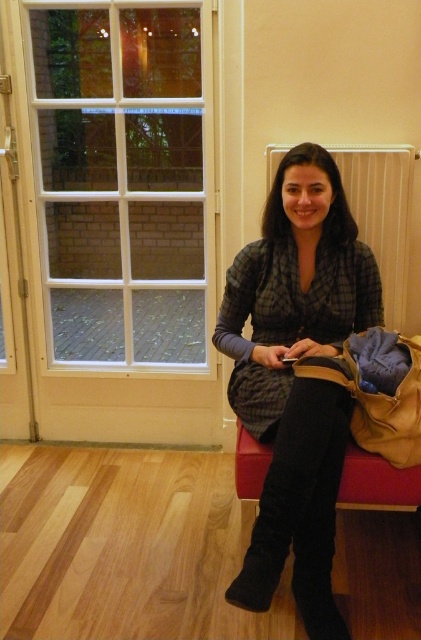
Can you confirm if matte plaid dress at center is positioned above leather-like stool at lower center?

Yes.

Does matte plaid dress at center have a greater height compared to leather-like stool at lower center?

Yes.

This screenshot has width=421, height=640. I want to click on matte plaid dress at center, so click(x=296, y=378).

Can you confirm if white textured radiator at upper center is shorter than leather-like stool at lower center?

Incorrect, white textured radiator at upper center's height does not fall short of leather-like stool at lower center's.

Based on the photo, who is higher up, white textured radiator at upper center or leather-like stool at lower center?

white textured radiator at upper center is higher up.

The height and width of the screenshot is (640, 421). What do you see at coordinates (381, 212) in the screenshot?
I see `white textured radiator at upper center` at bounding box center [381, 212].

Identify the location of white textured radiator at upper center. The width and height of the screenshot is (421, 640). (381, 212).

In the scene shown: Who is more distant from viewer, (394,408) or (244,476)?

Positioned behind is point (244,476).

Based on the photo, who is positioned more to the left, brown leather bag at lower center or leather-like stool at lower center?

Positioned to the left is brown leather bag at lower center.

Who is more distant from viewer, (x=365, y=435) or (x=252, y=481)?

The point (x=252, y=481) is more distant.

I want to click on brown leather bag at lower center, so click(378, 392).